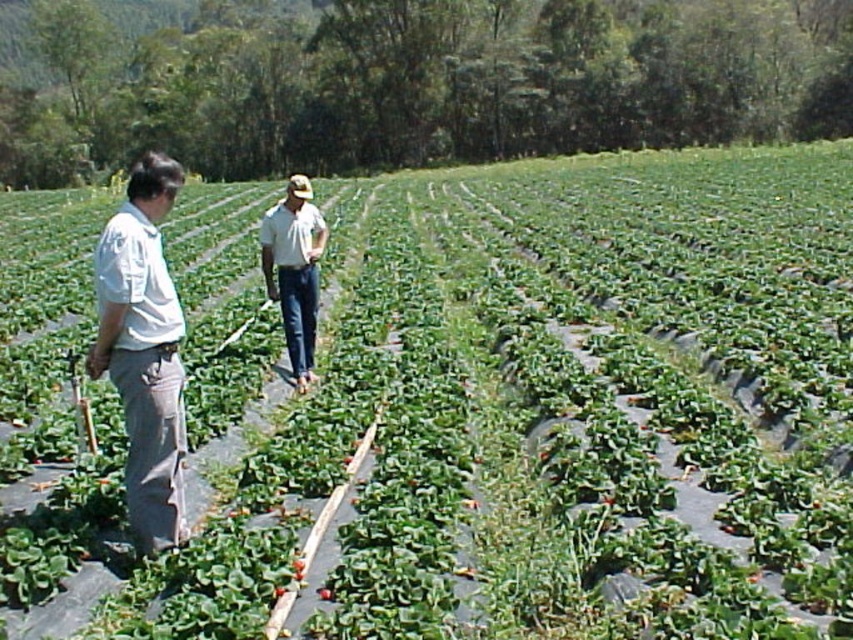
Question: Does white cotton shirt at left lie in front of denim jeans at center?

Choices:
 (A) no
 (B) yes

Answer: (B)

Question: Which of the following is the farthest from the observer?

Choices:
 (A) (135, 348)
 (B) (306, 220)

Answer: (B)

Question: Which point appears farthest from the camera in this image?

Choices:
 (A) (296, 284)
 (B) (177, 536)

Answer: (A)

Question: Can you confirm if white cotton shirt at left is smaller than denim jeans at center?

Choices:
 (A) no
 (B) yes

Answer: (B)

Question: Does white cotton shirt at left have a lesser width compared to denim jeans at center?

Choices:
 (A) yes
 (B) no

Answer: (B)

Question: Which of the following is the farthest from the observer?

Choices:
 (A) denim jeans at center
 (B) white cotton shirt at left

Answer: (A)